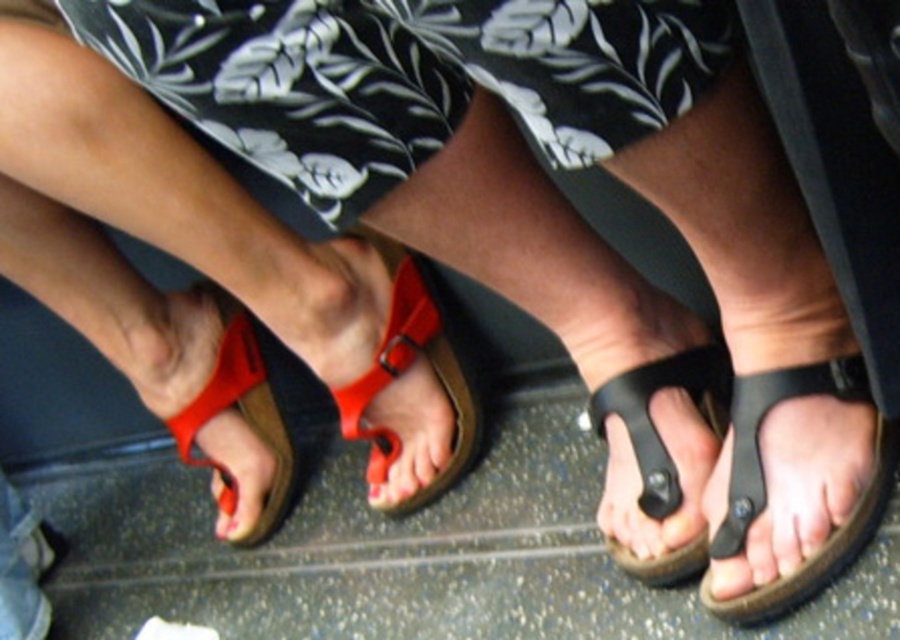
Question: Considering the real-world distances, which object is farthest from the black floral fabric at center?

Choices:
 (A) black rubber sandal at center
 (B) rubber matte flip-flop at lower left

Answer: (B)

Question: Is rubber matte flip-flop at center to the left of rubber matte flip-flop at lower left from the viewer's perspective?

Choices:
 (A) no
 (B) yes

Answer: (A)

Question: Does black rubber sandal at lower right appear on the right side of rubber matte flip-flop at center?

Choices:
 (A) yes
 (B) no

Answer: (A)

Question: Which is farther from the rubber matte flip-flop at center?

Choices:
 (A) black floral fabric at center
 (B) black rubber sandal at center
 (C) rubber matte flip-flop at lower left

Answer: (A)

Question: Can you confirm if black rubber sandal at center is positioned above rubber matte flip-flop at center?

Choices:
 (A) no
 (B) yes

Answer: (A)

Question: Which point appears closest to the camera in this image?

Choices:
 (A) (414, 336)
 (B) (893, 468)
 (C) (711, 365)
 (D) (540, 67)

Answer: (D)